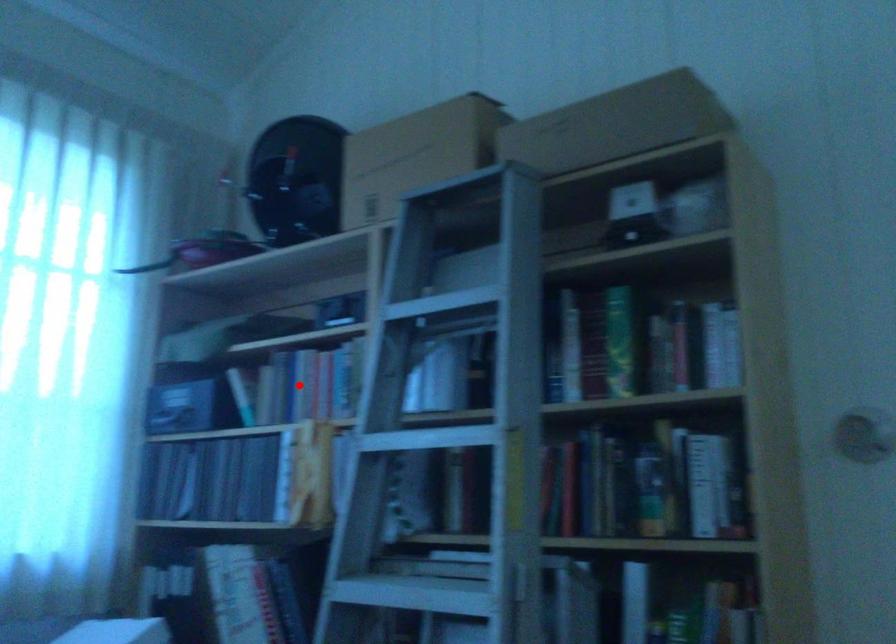
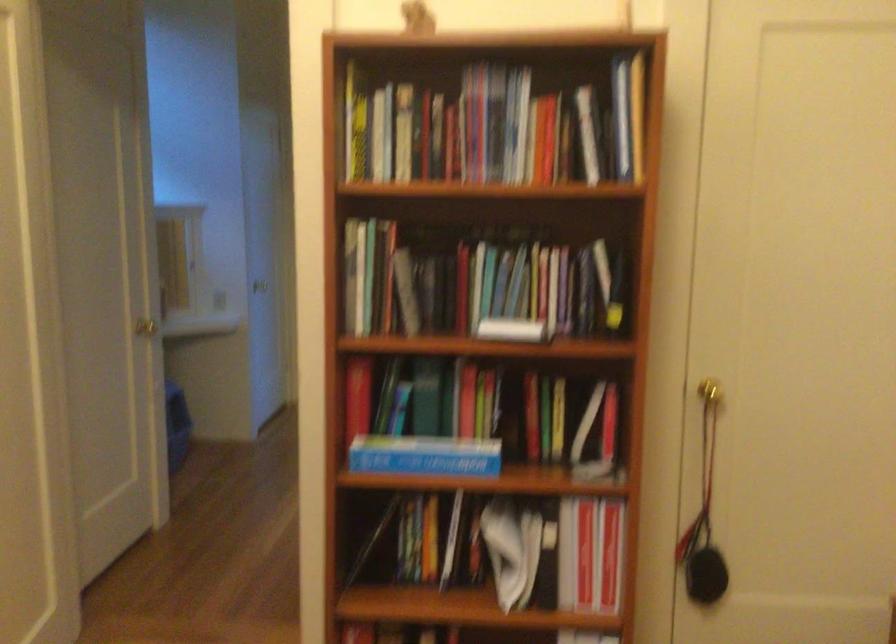
Question: I am providing you with two images of the same scene from different viewpoints. A red point is marked on the first image. Can you still see the location of the red point in image 2?

Choices:
 (A) Yes
 (B) No

Answer: (B)